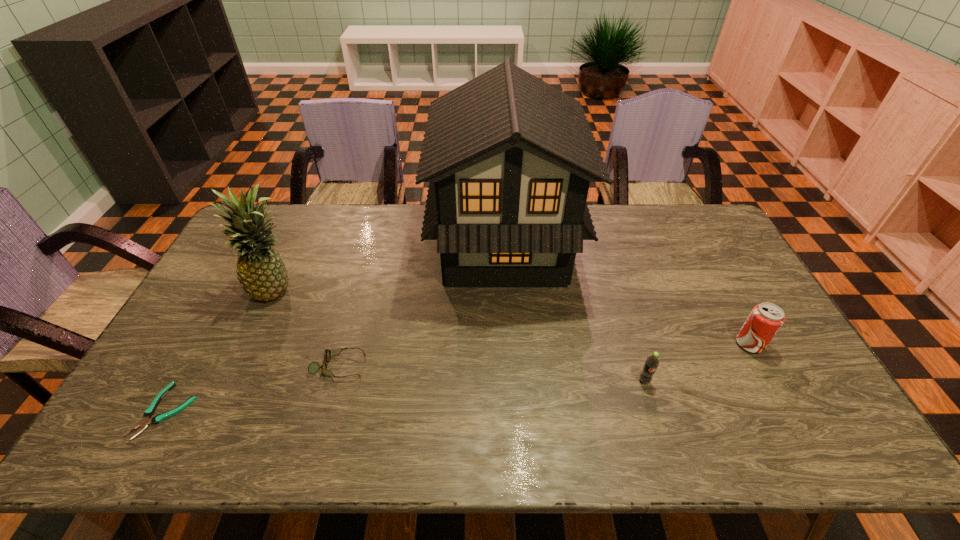
This screenshot has width=960, height=540. Identify the location of dollhouse. (509, 158).

Image resolution: width=960 pixels, height=540 pixels. What are the coordinates of `the fourth object from left to right` in the screenshot? It's located at (509, 158).

The height and width of the screenshot is (540, 960). In order to click on pineapple in this screenshot , I will do 261,272.

At what (x,y) coordinates should I click in order to perform the action: click on the fourth shortest object. Please return your answer as a coordinate pair (x, y). The width and height of the screenshot is (960, 540). Looking at the image, I should click on (765, 320).

At what (x,y) coordinates should I click in order to perform the action: click on the taller soda. Please return your answer as a coordinate pair (x, y). Looking at the image, I should click on (765, 320).

Image resolution: width=960 pixels, height=540 pixels. I want to click on the third shortest object, so click(652, 362).

Identify the location of the shorter soda. (652, 362).

You are a GUI agent. You are given a task and a screenshot of the screen. Output one action in this format:
    pyautogui.click(x=<x>, y=<y>)
    Task: Click on the fifth tallest object
    
    Given the screenshot: What is the action you would take?
    pyautogui.click(x=313, y=368)

This screenshot has height=540, width=960. Find the location of `the third object from left to right`. the third object from left to right is located at coordinates (313, 368).

You are a GUI agent. You are given a task and a screenshot of the screen. Output one action in this format:
    pyautogui.click(x=<x>, y=<y>)
    Task: Click on the shortest object
    
    Given the screenshot: What is the action you would take?
    pyautogui.click(x=149, y=412)